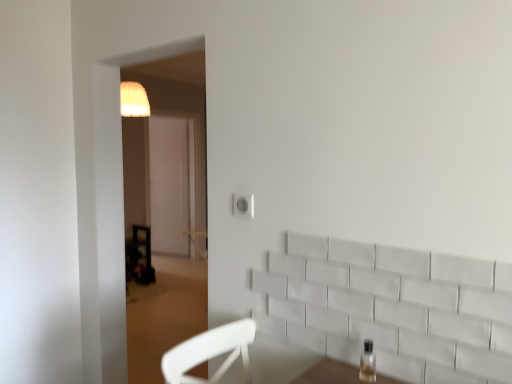
Question: Considering the positions of point (371, 380) and point (248, 208), is point (371, 380) closer or farther from the camera than point (248, 208)?

Choices:
 (A) closer
 (B) farther

Answer: (A)

Question: Is clear glass bottle at lower right bigger or smaller than white matte electric outlet at center?

Choices:
 (A) big
 (B) small

Answer: (A)

Question: Considering the relative positions of clear glass bottle at lower right and white matte electric outlet at center in the image provided, is clear glass bottle at lower right to the left or to the right of white matte electric outlet at center?

Choices:
 (A) right
 (B) left

Answer: (A)

Question: Relative to clear glass bottle at lower right, is white matte electric outlet at center in front or behind?

Choices:
 (A) front
 (B) behind

Answer: (B)

Question: Is white matte electric outlet at center taller or shorter than clear glass bottle at lower right?

Choices:
 (A) tall
 (B) short

Answer: (B)

Question: Based on their sizes in the image, would you say white matte electric outlet at center is bigger or smaller than clear glass bottle at lower right?

Choices:
 (A) small
 (B) big

Answer: (A)

Question: From a real-world perspective, is white matte electric outlet at center above or below clear glass bottle at lower right?

Choices:
 (A) below
 (B) above

Answer: (B)